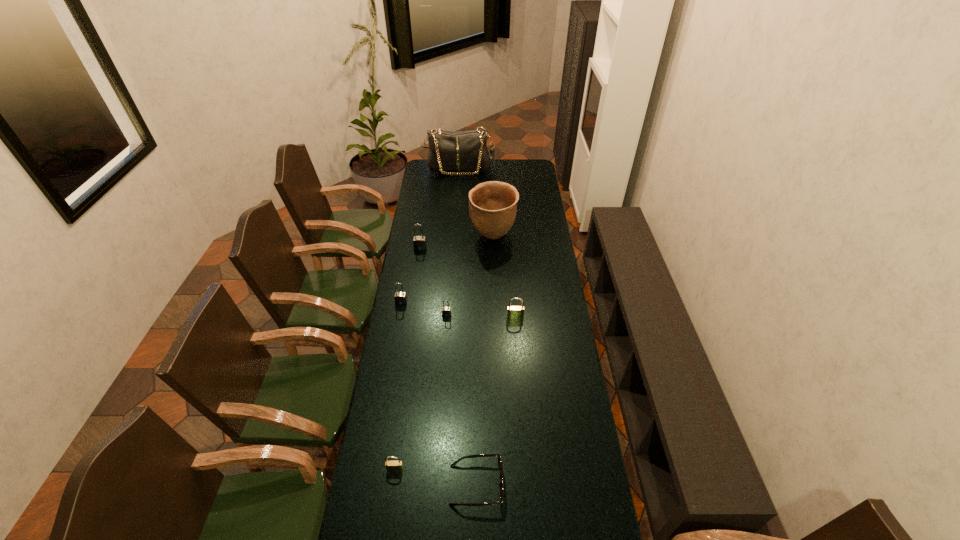
The height and width of the screenshot is (540, 960). In order to click on handbag in this screenshot , I will do `click(466, 151)`.

Identify the location of pottery. (492, 205).

Locate an element on the screen. The width and height of the screenshot is (960, 540). the farthest gray padlock is located at coordinates (419, 242).

Find the location of a particular element. This screenshot has width=960, height=540. the biggest gray padlock is located at coordinates (419, 242).

Identify the location of the fifth nearest object. (400, 298).

This screenshot has width=960, height=540. I want to click on the second nearest gray padlock, so click(x=400, y=298).

Locate an element on the screen. This screenshot has width=960, height=540. the farther brass padlock is located at coordinates (513, 312).

You are a GUI agent. You are given a task and a screenshot of the screen. Output one action in this format:
    pyautogui.click(x=<x>, y=<y>)
    Task: Click on the bigger brass padlock
    
    Given the screenshot: What is the action you would take?
    pyautogui.click(x=513, y=312)

Locate an element on the screen. This screenshot has width=960, height=540. the smallest gray padlock is located at coordinates (446, 311).

You are a GUI agent. You are given a task and a screenshot of the screen. Output one action in this format:
    pyautogui.click(x=<x>, y=<y>)
    Task: Click on the rightmost gray padlock
    
    Given the screenshot: What is the action you would take?
    pyautogui.click(x=446, y=311)